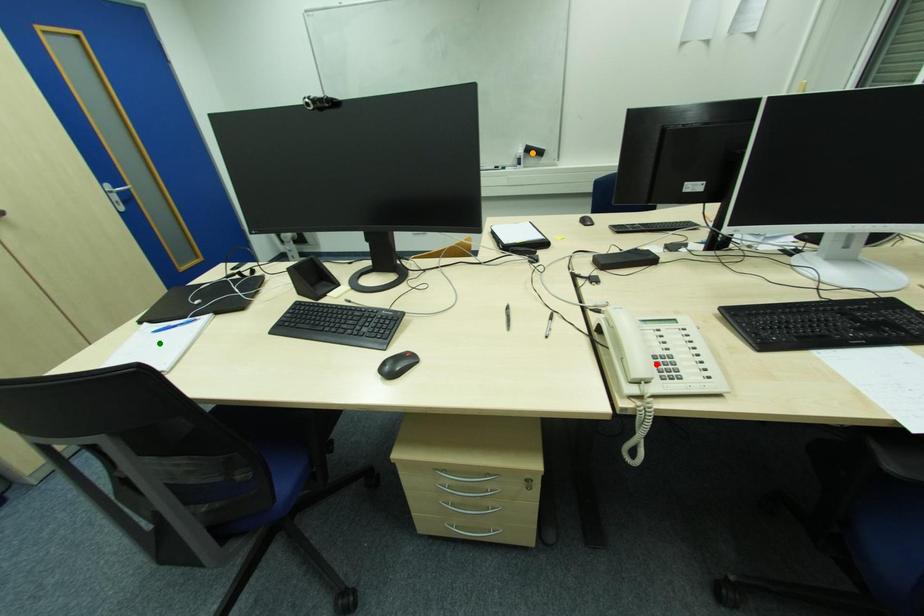
Order these from nearest to farthest:
1. green point
2. orange point
3. red point

orange point, green point, red point